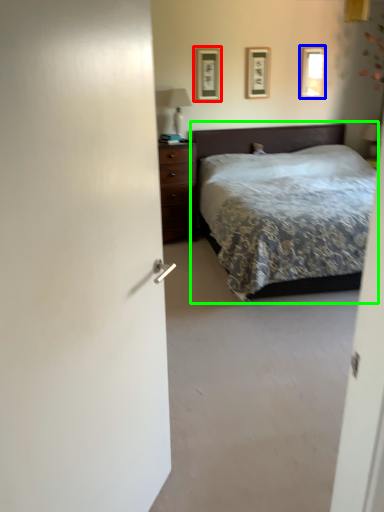
Question: Considering the real-world distances, which object is closest to picture frame (highlighted by a red box)? picture frame (highlighted by a blue box) or bed (highlighted by a green box).

Choices:
 (A) picture frame
 (B) bed

Answer: (B)